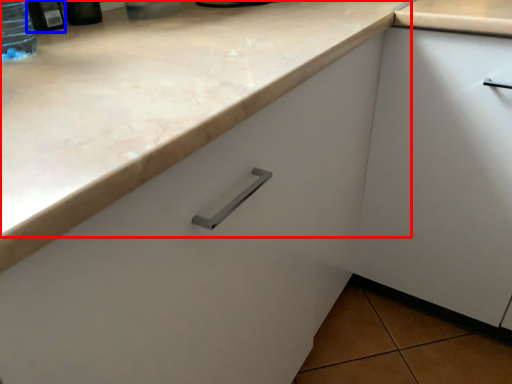
Question: Which point is closer to the camera, counter top (highlighted by a red box) or bottle (highlighted by a blue box)?

Choices:
 (A) counter top
 (B) bottle

Answer: (A)